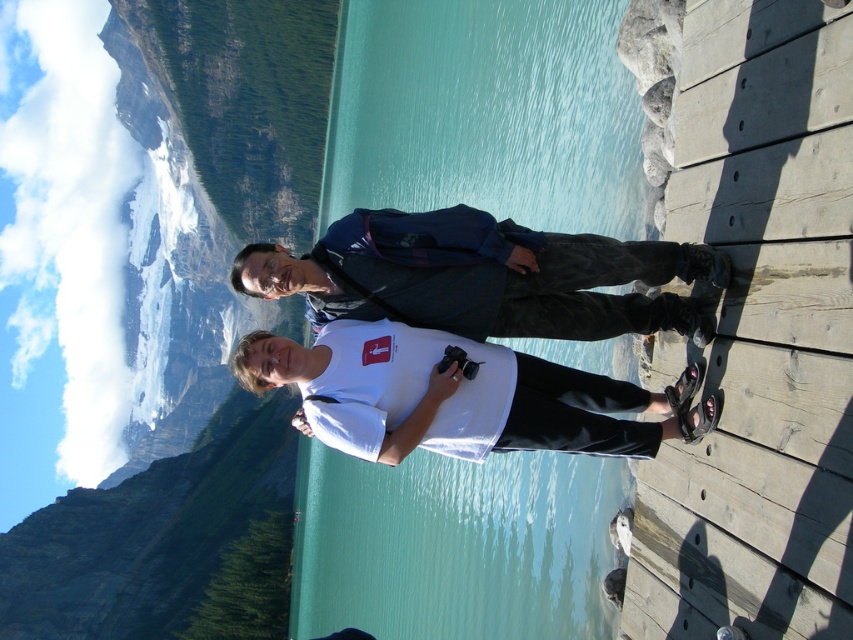
Can you confirm if turquoise water at center is thinner than white matte shirt at center?

Incorrect, turquoise water at center's width is not less than white matte shirt at center's.

Does turquoise water at center have a lesser height compared to white matte shirt at center?

No.

Does point (595, 458) lie in front of point (581, 413)?

No.

In order to click on turquoise water at center in this screenshot , I will do `click(485, 113)`.

Can you confirm if turquoise water at center is shorter than dark blue jacket at center?

No, turquoise water at center is not shorter than dark blue jacket at center.

Which is behind, point (346, 548) or point (538, 275)?

Positioned behind is point (346, 548).

Find the location of a particular element. turquoise water at center is located at coordinates click(x=485, y=113).

Which is more to the left, dark blue jacket at center or white matte shirt at center?

white matte shirt at center is more to the left.

Is dark blue jacket at center thinner than white matte shirt at center?

In fact, dark blue jacket at center might be wider than white matte shirt at center.

Who is more forward, (395, 225) or (531, 420)?

Point (531, 420) is in front.

In order to click on dark blue jacket at center in this screenshot , I will do `click(480, 276)`.